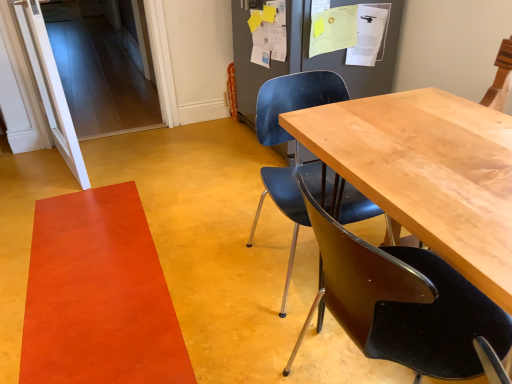
Question: Is matte black chair at center, which is the 1th chair from front to back, shorter than orange matte rug at lower left?

Choices:
 (A) no
 (B) yes

Answer: (A)

Question: Could orange matte rug at lower left be considered to be inside matte black chair at center, which is the 1th chair from front to back?

Choices:
 (A) yes
 (B) no

Answer: (B)

Question: From the image's perspective, does matte black chair at center, which appears as the 2th chair when viewed from the back, appear lower than orange matte rug at lower left?

Choices:
 (A) yes
 (B) no

Answer: (B)

Question: Is matte black chair at center, which is the 1th chair from front to back, looking in the opposite direction of orange matte rug at lower left?

Choices:
 (A) no
 (B) yes

Answer: (A)

Question: Does matte black chair at center, which appears as the 2th chair when viewed from the back, have a lesser width compared to orange matte rug at lower left?

Choices:
 (A) yes
 (B) no

Answer: (A)

Question: From a real-world perspective, does matte black chair at center, which is the 1th chair from front to back, sit lower than orange matte rug at lower left?

Choices:
 (A) yes
 (B) no

Answer: (B)

Question: Does light brown wood table at center have a greater width compared to orange matte rug at lower left?

Choices:
 (A) yes
 (B) no

Answer: (B)

Question: From the image's perspective, is light brown wood table at center over orange matte rug at lower left?

Choices:
 (A) yes
 (B) no

Answer: (A)

Question: Is light brown wood table at center turned away from orange matte rug at lower left?

Choices:
 (A) no
 (B) yes

Answer: (A)

Question: Is light brown wood table at center positioned before orange matte rug at lower left?

Choices:
 (A) yes
 (B) no

Answer: (A)

Question: Is light brown wood table at center thinner than orange matte rug at lower left?

Choices:
 (A) yes
 (B) no

Answer: (A)

Question: From a real-world perspective, is light brown wood table at center positioned under orange matte rug at lower left based on gravity?

Choices:
 (A) no
 (B) yes

Answer: (A)

Question: Considering the relative positions of orange matte rug at lower left and light brown wood table at center in the image provided, is orange matte rug at lower left to the right of light brown wood table at center from the viewer's perspective?

Choices:
 (A) no
 (B) yes

Answer: (A)